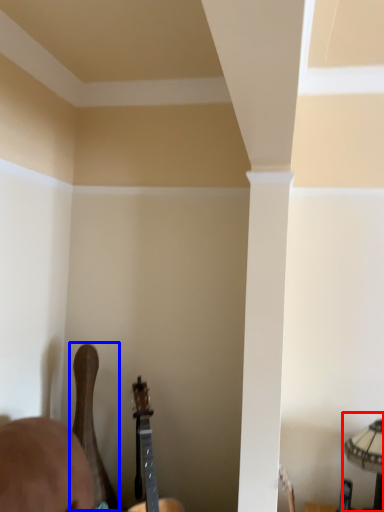
Question: Which object is further to the camera taking this photo, lamp (highlighted by a red box) or guitar (highlighted by a blue box)?

Choices:
 (A) lamp
 (B) guitar

Answer: (B)